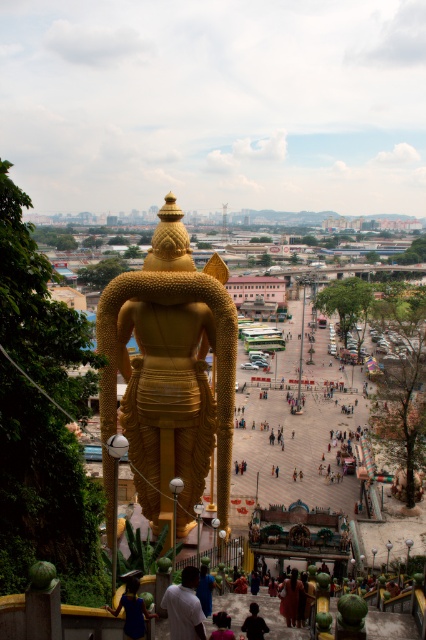
Question: Which of the following is the closest to the observer?

Choices:
 (A) matte red dress at center
 (B) gold polished statue at center
 (C) blue fabric at lower center

Answer: (B)

Question: Does blue fabric dress at lower center lie in front of matte red dress at center?

Choices:
 (A) no
 (B) yes

Answer: (B)

Question: Considering the relative positions of gold polished statue at center and matte red dress at center in the image provided, where is gold polished statue at center located with respect to matte red dress at center?

Choices:
 (A) right
 (B) left

Answer: (B)

Question: Is matte red dress at center above dark purple fabric at lower center?

Choices:
 (A) no
 (B) yes

Answer: (A)

Question: Which object appears farthest from the camera in this image?

Choices:
 (A) dark fabric shirt at center
 (B) matte red dress at center
 (C) blue fabric dress at lower center

Answer: (B)

Question: Which object is the farthest from the blue fabric dress at lower center?

Choices:
 (A) gold polished statue at center
 (B) white matte shirt at center
 (C) blue fabric at lower center
 (D) matte red dress at center

Answer: (A)